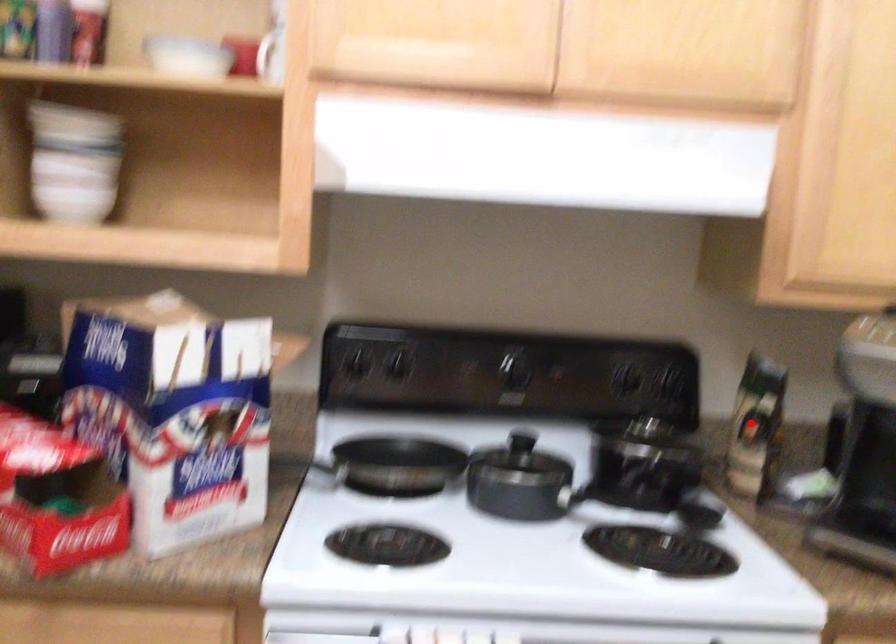
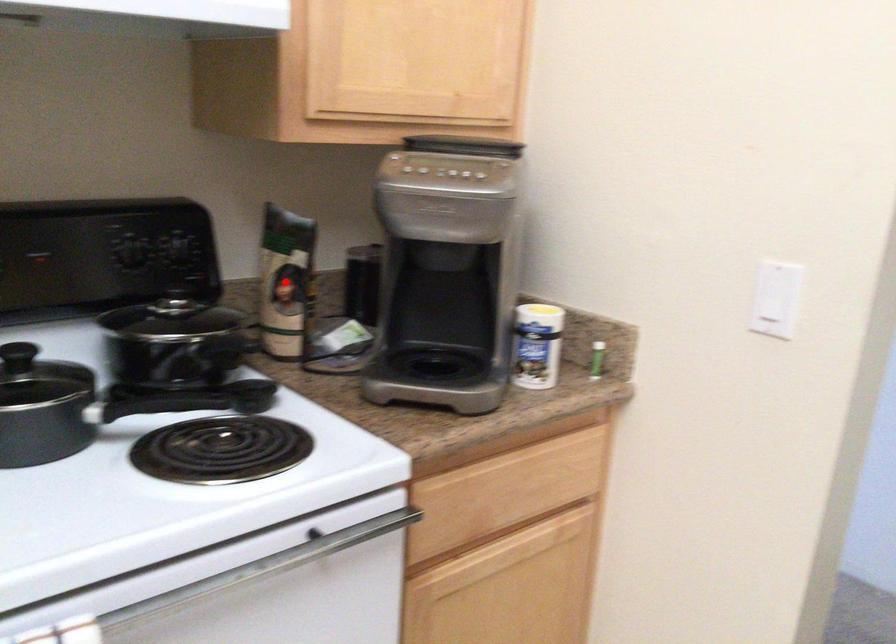
I am providing you with two images of the same scene from different viewpoints. A red point is marked on the first image and another point is marked on the second image. Do the highlighted points in image1 and image2 indicate the same real-world spot?

Yes